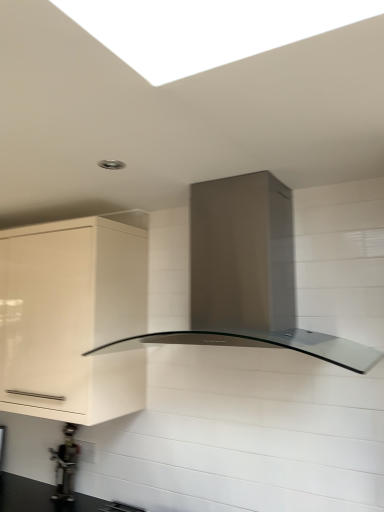
Measure the distance between point [282,203] and camera.

Point [282,203] and camera are 5.44 feet apart from each other.

This screenshot has width=384, height=512. I want to click on white glossy cabinet at left, so click(x=72, y=319).

You are a GUI agent. You are given a task and a screenshot of the screen. Output one action in this format:
    pyautogui.click(x=<x>, y=<y>)
    Task: Click on the metallic gray water heater at lower left
    This screenshot has width=384, height=512.
    Given the screenshot: What is the action you would take?
    pyautogui.click(x=65, y=464)

Find the location of a particular element. satin metallic range hood at center is located at coordinates (278, 269).

From the picture: Would you say metallic gray water heater at lower left is to the left or to the right of white glossy cabinet at left in the picture?

From the image, it's evident that metallic gray water heater at lower left is to the right of white glossy cabinet at left.

Is metallic gray water heater at lower left facing towards white glossy cabinet at left?

No.

Does metallic gray water heater at lower left come in front of white glossy cabinet at left?

No, metallic gray water heater at lower left is behind white glossy cabinet at left.

Is point (85, 321) farther from viewer compared to point (65, 497)?

No, it is in front of (65, 497).

Is white glossy cabinet at left to the right of metallic gray water heater at lower left from the viewer's perspective?

Incorrect, white glossy cabinet at left is not on the right side of metallic gray water heater at lower left.

Is white glossy cabinet at left inside or outside of metallic gray water heater at lower left?

white glossy cabinet at left is outside metallic gray water heater at lower left.

From a real-world perspective, does satin metallic range hood at center stand above metallic gray water heater at lower left?

Yes, from a real-world perspective, satin metallic range hood at center is above metallic gray water heater at lower left.

Consider the image. From their relative heights in the image, would you say satin metallic range hood at center is taller or shorter than metallic gray water heater at lower left?

Clearly, satin metallic range hood at center is taller compared to metallic gray water heater at lower left.

Which object is closer to the camera, satin metallic range hood at center or metallic gray water heater at lower left?

Positioned in front is satin metallic range hood at center.

Is there a large distance between satin metallic range hood at center and metallic gray water heater at lower left?

Indeed, satin metallic range hood at center is not near metallic gray water heater at lower left.

From a real-world perspective, is white glossy cabinet at left below satin metallic range hood at center?

Correct, in the physical world, white glossy cabinet at left is lower than satin metallic range hood at center.

Do you think white glossy cabinet at left is within satin metallic range hood at center, or outside of it?

white glossy cabinet at left is outside satin metallic range hood at center.

Which of these two, white glossy cabinet at left or satin metallic range hood at center, stands taller?

white glossy cabinet at left is taller.

Is white glossy cabinet at left turned away from satin metallic range hood at center?

No, white glossy cabinet at left's orientation is not away from satin metallic range hood at center.

Are satin metallic range hood at center and white glossy cabinet at left far apart?

satin metallic range hood at center is actually quite close to white glossy cabinet at left.

Considering the points (368, 280) and (33, 227), which point is behind, point (368, 280) or point (33, 227)?

The point (33, 227) is more distant.

From the image's perspective, is satin metallic range hood at center above or below white glossy cabinet at left?

satin metallic range hood at center is above white glossy cabinet at left.

Which is behind, satin metallic range hood at center or white glossy cabinet at left?

white glossy cabinet at left.

Which object is thinner, metallic gray water heater at lower left or satin metallic range hood at center?

metallic gray water heater at lower left.

Does metallic gray water heater at lower left lie behind satin metallic range hood at center?

Yes, it is behind satin metallic range hood at center.

Does metallic gray water heater at lower left turn towards satin metallic range hood at center?

No, metallic gray water heater at lower left is not oriented towards satin metallic range hood at center.

Can you tell me how much metallic gray water heater at lower left and satin metallic range hood at center differ in facing direction?

There is a 2.04-degree angle between the facing directions of metallic gray water heater at lower left and satin metallic range hood at center.

Locate an element on the screen. The height and width of the screenshot is (512, 384). cabinetry located in front of the metallic gray water heater at lower left is located at coordinates (72, 319).

Find the location of a particular element. appliance below the white glossy cabinet at left (from a real-world perspective) is located at coordinates (65, 464).

Looking at the image, which one is located closer to white glossy cabinet at left, metallic gray water heater at lower left or satin metallic range hood at center?

satin metallic range hood at center lies closer to white glossy cabinet at left than the other object.

Estimate the real-world distances between objects in this image. Which object is further from white glossy cabinet at left, satin metallic range hood at center or metallic gray water heater at lower left?

metallic gray water heater at lower left.

Looking at the image, which one is located closer to metallic gray water heater at lower left, satin metallic range hood at center or white glossy cabinet at left?

white glossy cabinet at left.

Estimate the real-world distances between objects in this image. Which object is further from satin metallic range hood at center, metallic gray water heater at lower left or white glossy cabinet at left?

The object further to satin metallic range hood at center is metallic gray water heater at lower left.

Estimate the real-world distances between objects in this image. Which object is closer to satin metallic range hood at center, white glossy cabinet at left or metallic gray water heater at lower left?

white glossy cabinet at left is closer to satin metallic range hood at center.

Looking at the image, which one is located further to metallic gray water heater at lower left, white glossy cabinet at left or satin metallic range hood at center?

Among the two, satin metallic range hood at center is located further to metallic gray water heater at lower left.

At what (x,y) coordinates should I click in order to perform the action: click on cabinetry between satin metallic range hood at center and metallic gray water heater at lower left in the up-down direction. Please return your answer as a coordinate pair (x, y). This screenshot has height=512, width=384. Looking at the image, I should click on (72, 319).